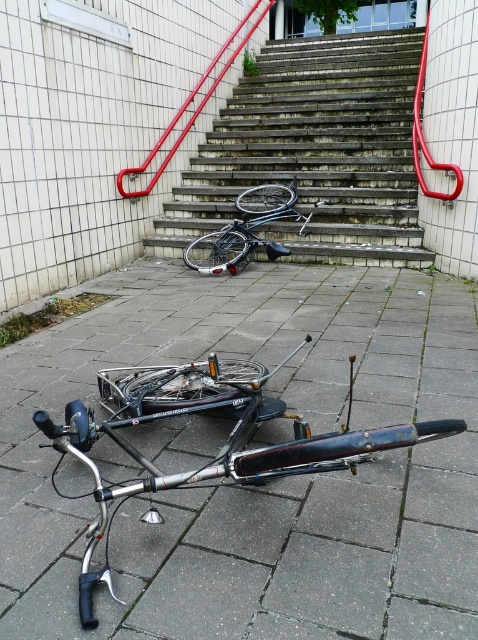
Consider the image. Is shiny metallic bicycle at center shorter than red metal handrail at upper center?

Yes, shiny metallic bicycle at center is shorter than red metal handrail at upper center.

Who is more forward, (x=206, y=236) or (x=192, y=115)?

Point (x=206, y=236)

Locate an element on the screen. The height and width of the screenshot is (640, 478). shiny metallic bicycle at center is located at coordinates (249, 228).

Does smooth concrete pavement at center have a greater height compared to red metal handrail at upper center?

Incorrect, smooth concrete pavement at center's height is not larger of red metal handrail at upper center's.

Is smooth concrete pavement at center to the right of red metal handrail at upper center from the viewer's perspective?

Indeed, smooth concrete pavement at center is positioned on the right side of red metal handrail at upper center.

Between point (305, 556) and point (217, 58), which one is positioned in front?

Point (305, 556)

Identify the location of smooth concrete pavement at center. The image size is (478, 640). (270, 483).

Which is below, smooth concrete pavement at center or shiny metallic bicycle at center?

smooth concrete pavement at center is lower down.

This screenshot has width=478, height=640. What are the coordinates of `smooth concrete pavement at center` in the screenshot? It's located at (270, 483).